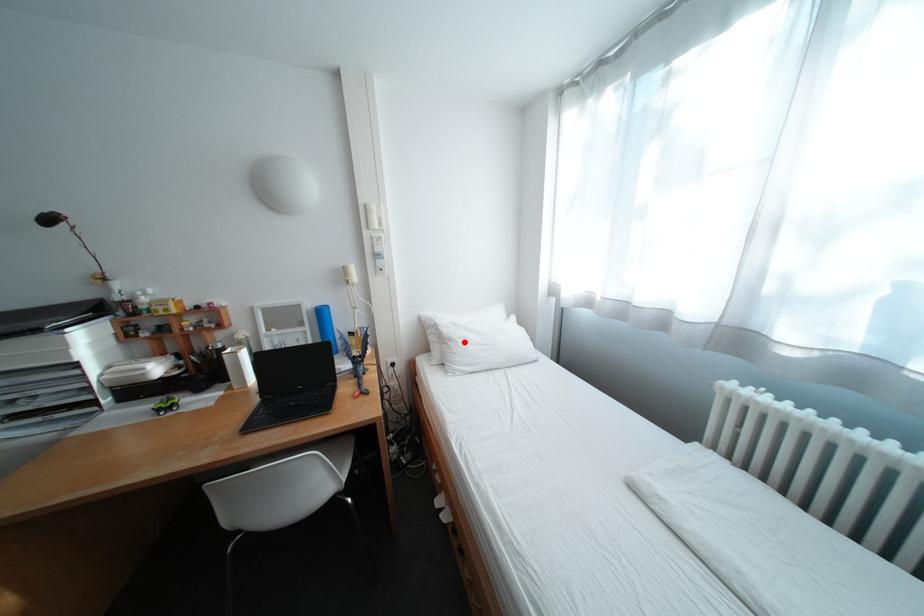
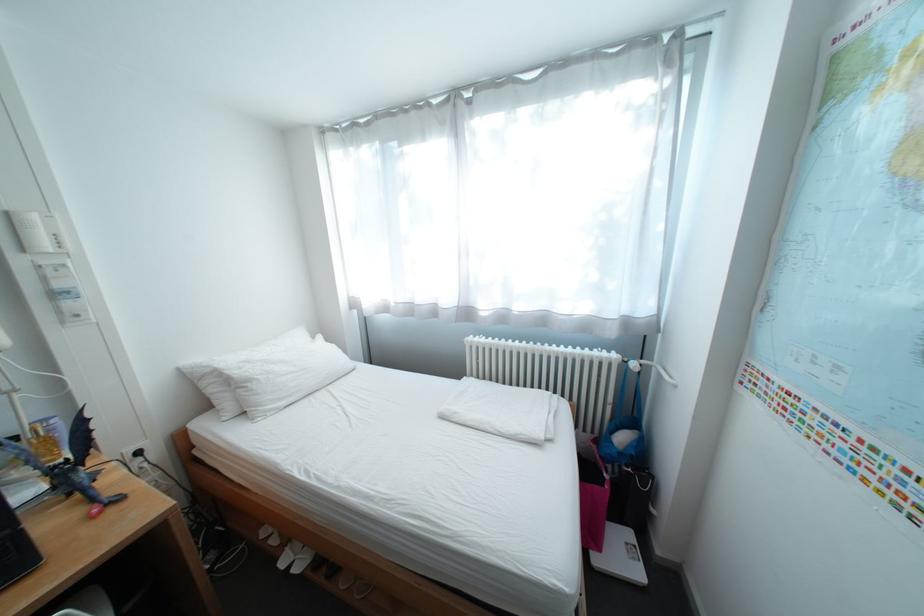
The point at the highlighted location is marked in the first image. Where is the corresponding point in the second image?

(263, 383)